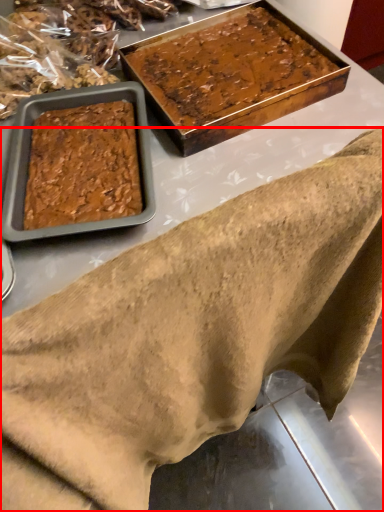
Question: Observing the image, what is the correct spatial positioning of wrap (annotated by the red box) in reference to dessert?

Choices:
 (A) right
 (B) left

Answer: (B)